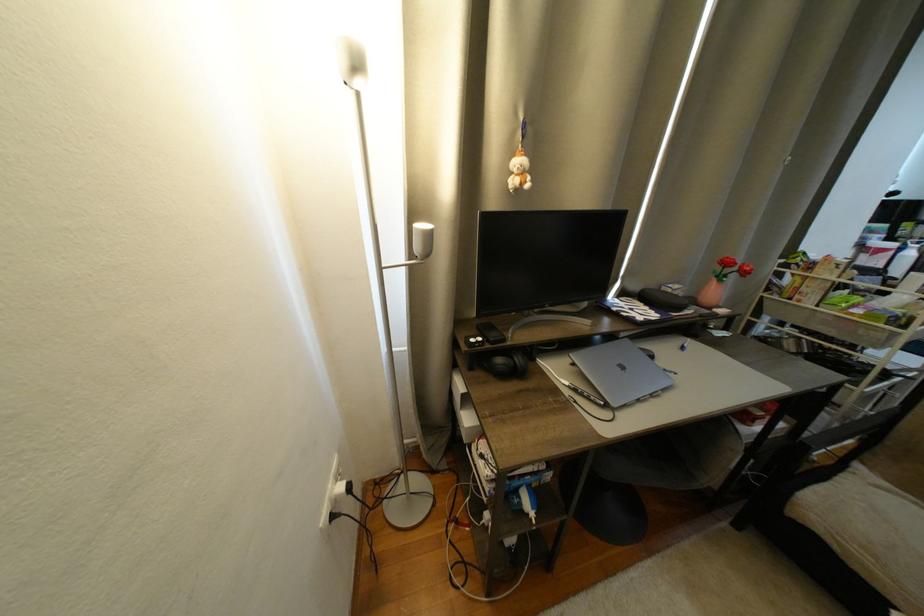
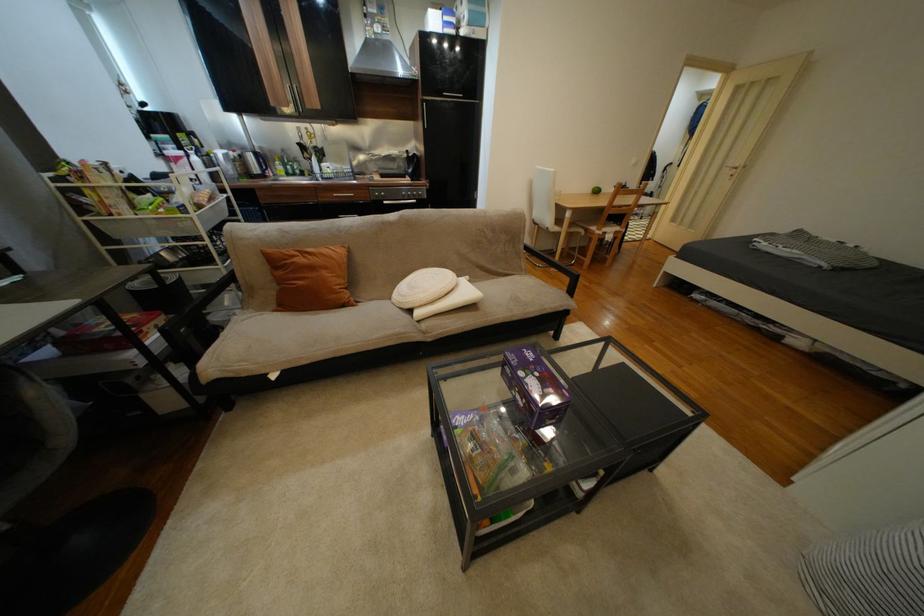
The images are taken continuously from a first-person perspective. In which direction is your viewpoint rotating?

The rotation direction of the camera is right-down.